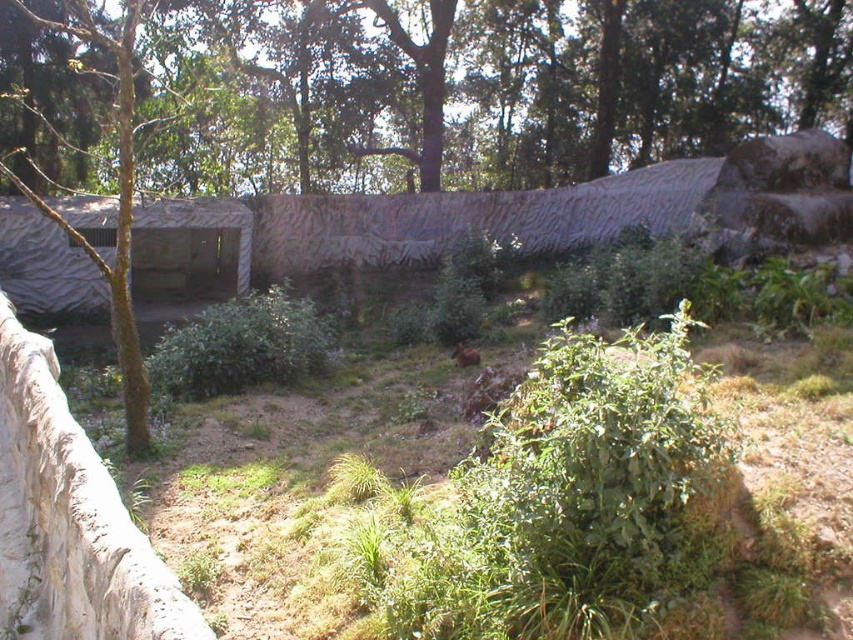
Who is more forward, (22, 212) or (462, 346)?

Positioned in front is point (462, 346).

At what (x,y) coordinates should I click in order to perform the action: click on camouflage fabric hut at left. Please return your answer as a coordinate pair (x, y). Looking at the image, I should click on (189, 241).

Can you confirm if green leafy tree at center is positioned above green leafy tree at upper center?

No.

At what (x,y) coordinates should I click in order to perform the action: click on green leafy tree at center. Please return your answer as a coordinate pair (x, y). This screenshot has height=640, width=853. Looking at the image, I should click on (451, 140).

I want to click on green leafy tree at center, so click(451, 140).

Is point (308, 77) in front of point (189, 209)?

No, it is not.

From the picture: Does green leafy tree at upper center have a lesser width compared to camouflage fabric hut at left?

No.

What do you see at coordinates (410, 88) in the screenshot? This screenshot has width=853, height=640. I see `green leafy tree at upper center` at bounding box center [410, 88].

Find the location of a particular element. The height and width of the screenshot is (640, 853). green leafy tree at upper center is located at coordinates (410, 88).